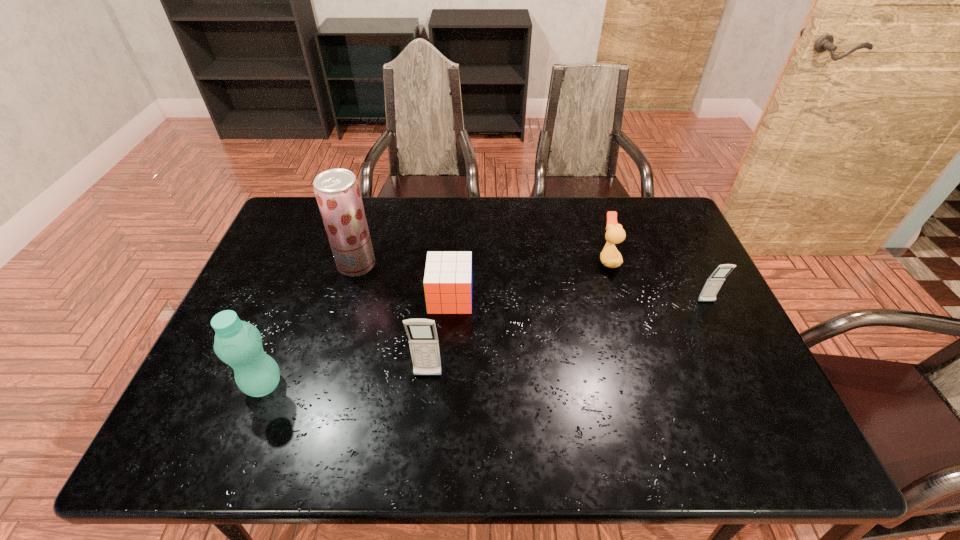
To achieve uniform spacing by inserting another cellular_telephone among them, please point to a free space for this new cellular_telephone. Please provide its 2D coordinates. Your answer should be formatted as a tuple, i.e. [(x, y)], where the tuple contains the x and y coordinates of a point satisfying the conditions above.

[(577, 336)]